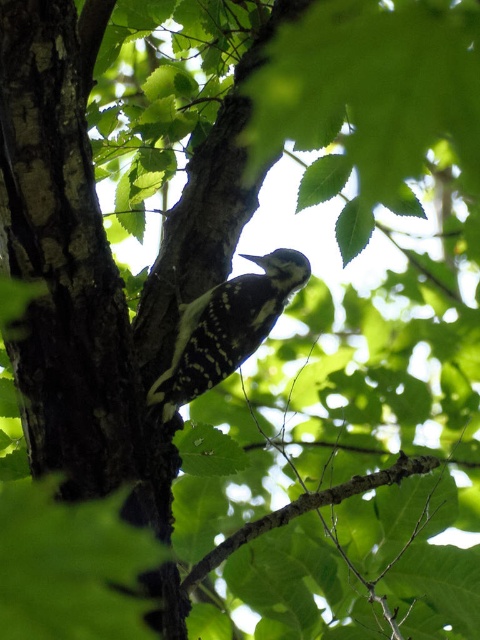
Between dark brown bark at center and black and white speckled woodpecker at center, which one is positioned lower?

Positioned lower is black and white speckled woodpecker at center.

Consider the image. Does dark brown bark at center appear on the left side of black and white speckled woodpecker at center?

Yes, dark brown bark at center is to the left of black and white speckled woodpecker at center.

Between point (72, 419) and point (294, 291), which one is positioned in front?

Point (72, 419)

Locate an element on the screen. The width and height of the screenshot is (480, 640). dark brown bark at center is located at coordinates (71, 273).